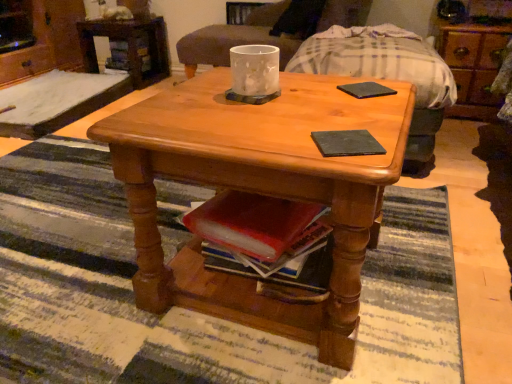
Find the location of `vacant area that lies between translucent glass candle at center and black matte pad at center, positioned as the 1th pad in left-to-right order`. vacant area that lies between translucent glass candle at center and black matte pad at center, positioned as the 1th pad in left-to-right order is located at coordinates (294, 117).